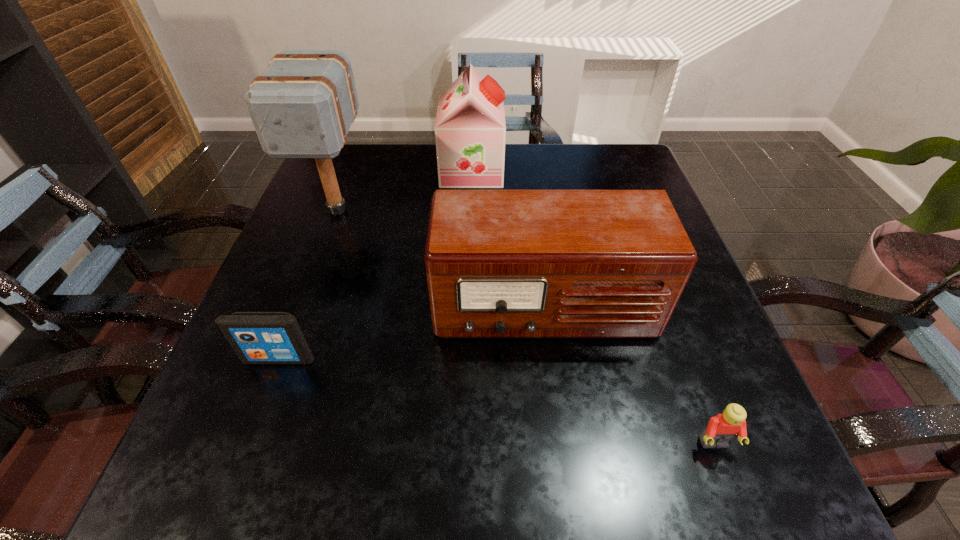
You are a GUI agent. You are given a task and a screenshot of the screen. Output one action in this format:
    pyautogui.click(x=<x>, y=<y>)
    Task: Click on the vacant space located 0.190m on the front screen of the fourth farthest object
    The image size is (960, 540).
    Given the screenshot: What is the action you would take?
    pyautogui.click(x=234, y=478)

Locate an element on the screen. mallet located at the far edge is located at coordinates (302, 106).

Where is `soya milk positioned at the far edge`? soya milk positioned at the far edge is located at coordinates (470, 130).

At what (x,y) coordinates should I click in order to perform the action: click on object that is at the near edge. Please return your answer as a coordinate pair (x, y). The width and height of the screenshot is (960, 540). Looking at the image, I should click on (722, 428).

At what (x,y) coordinates should I click in order to perform the action: click on mallet located in the left edge section of the desktop. Please return your answer as a coordinate pair (x, y). Looking at the image, I should click on (302, 106).

I want to click on iPod at the left edge, so click(257, 337).

You are a GUI agent. You are given a task and a screenshot of the screen. Output one action in this format:
    pyautogui.click(x=<x>, y=<y>)
    Task: Click on the radio receiver located at the right edge
    The image size is (960, 540).
    Given the screenshot: What is the action you would take?
    pyautogui.click(x=499, y=263)

Image resolution: width=960 pixels, height=540 pixels. Find the location of `Lego that is at the right edge`. Lego that is at the right edge is located at coordinates (722, 428).

Image resolution: width=960 pixels, height=540 pixels. What are the coordinates of `object that is at the far left corner` in the screenshot? It's located at (302, 106).

Find the location of `object present at the near right corner`. object present at the near right corner is located at coordinates click(x=722, y=428).